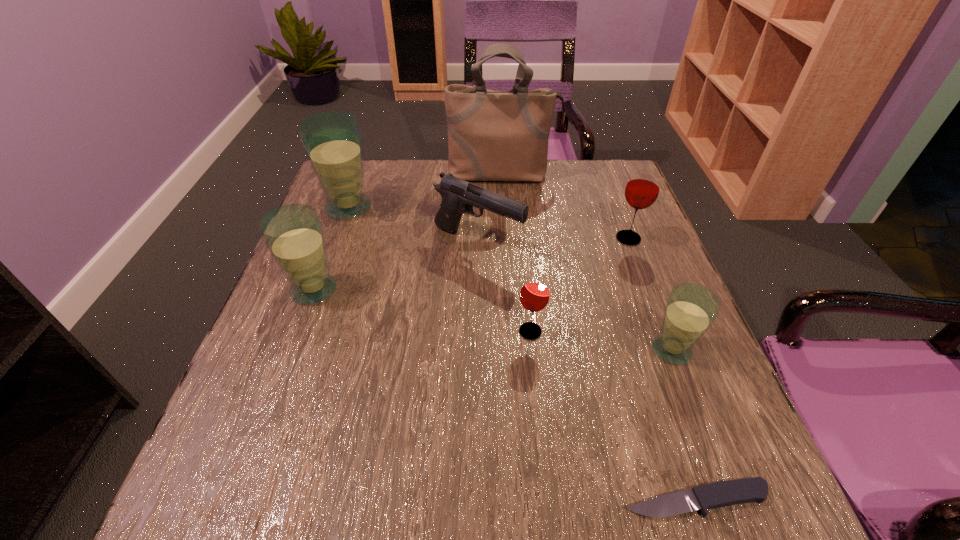
Find the location of a particular element. vacant space at the near edge is located at coordinates (581, 519).

Identify the location of free space at the left edge of the desktop. [x=381, y=216].

Image resolution: width=960 pixels, height=540 pixels. Identify the location of vacant area at the right edge. (634, 279).

Where is `vacant space at the far left corner`? vacant space at the far left corner is located at coordinates (370, 163).

Image resolution: width=960 pixels, height=540 pixels. What are the coordinates of `vacant space at the near left corner of the desktop` in the screenshot? It's located at (225, 471).

Find the location of a particular element. The image size is (960, 540). free space at the far right corner of the desktop is located at coordinates (627, 203).

The image size is (960, 540). Find the location of `unoccupied position between the rightmost blue glass and the tallest glass`. unoccupied position between the rightmost blue glass and the tallest glass is located at coordinates (510, 279).

At what (x,y) coordinates should I click in order to perform the action: click on vacant point located between the left red glass and the farther red glass. Please return your answer as a coordinate pair (x, y). The height and width of the screenshot is (540, 960). Looking at the image, I should click on (579, 285).

Where is `free space between the right red glass and the black gun`? This screenshot has height=540, width=960. free space between the right red glass and the black gun is located at coordinates (553, 241).

You are a GUI agent. You are given a task and a screenshot of the screen. Output one action in this format:
    pyautogui.click(x=<x>, y=<y>)
    Task: Click on the free spot between the shortest object and the fourth nearest glass
    This screenshot has height=540, width=960.
    Given the screenshot: What is the action you would take?
    (x=662, y=369)